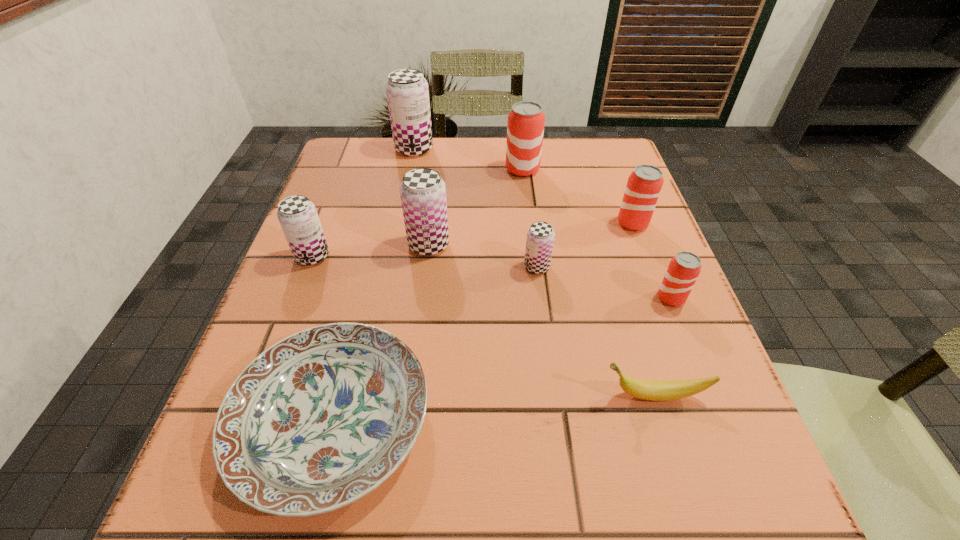
Find the location of a particular element. This screenshot has height=540, width=960. the tallest beer can is located at coordinates (407, 91).

Image resolution: width=960 pixels, height=540 pixels. Identify the location of the farthest purple beer can. (407, 91).

Find the location of a particular element. the farthest orange beer can is located at coordinates (525, 127).

Identify the location of the leftmost orange beer can. The width and height of the screenshot is (960, 540). (525, 127).

The width and height of the screenshot is (960, 540). Identify the location of the third smallest purple beer can. (423, 192).

Locate an element on the screen. The height and width of the screenshot is (540, 960). the second nearest orange beer can is located at coordinates (644, 185).

Locate an element on the screen. Image resolution: width=960 pixels, height=540 pixels. the leftmost beer can is located at coordinates (298, 217).

The width and height of the screenshot is (960, 540). In order to click on the leftmost purple beer can in this screenshot , I will do `click(298, 217)`.

Identify the location of the rightmost purple beer can. (540, 236).

The width and height of the screenshot is (960, 540). Find the location of `the seventh farthest object`. the seventh farthest object is located at coordinates (684, 268).